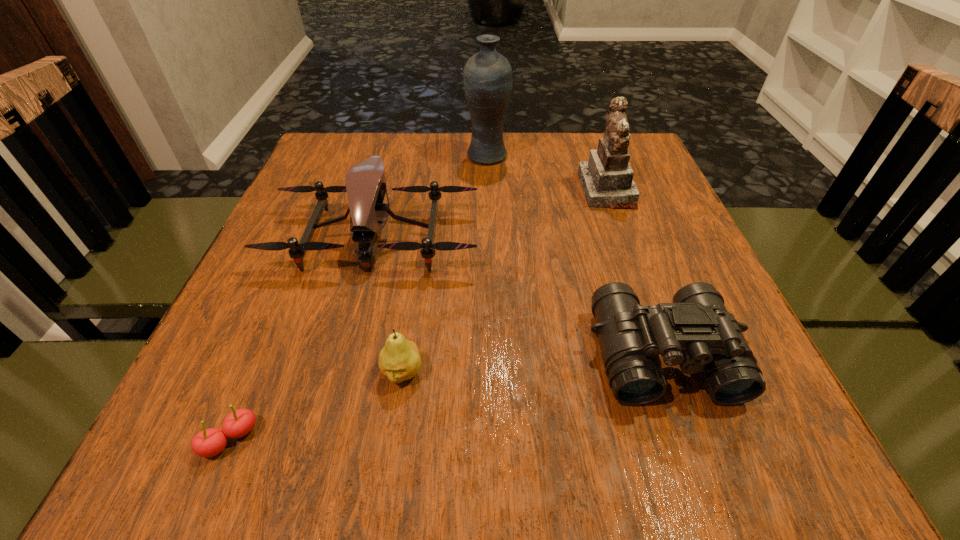
Where is `vacant space at the near right corner`? vacant space at the near right corner is located at coordinates (749, 423).

Where is `free spot between the second tallest object and the third shortest object`? free spot between the second tallest object and the third shortest object is located at coordinates (635, 272).

This screenshot has width=960, height=540. Find the location of `vacant region between the fourth tallest object and the pear`. vacant region between the fourth tallest object and the pear is located at coordinates (532, 364).

The height and width of the screenshot is (540, 960). I want to click on free spot between the pear and the second tallest object, so click(x=504, y=281).

Where is `free space between the vase and the third shortest object`? free space between the vase and the third shortest object is located at coordinates (575, 255).

What are the coordinates of `free area in between the vase and the binoculars` in the screenshot? It's located at (575, 255).

You are a GUI agent. You are given a task and a screenshot of the screen. Output one action in this format:
    pyautogui.click(x=<x>, y=<y>)
    Task: Click on the free space that is in between the tallest object and the second shortest object
    
    Given the screenshot: What is the action you would take?
    pyautogui.click(x=444, y=264)

This screenshot has height=540, width=960. In order to click on free area in between the vase and the fourth tallest object in this screenshot , I will do `click(575, 255)`.

At what (x,y) coordinates should I click in order to perform the action: click on free spot between the fifth tallest object and the farthest object. Please return your answer as a coordinate pair (x, y). The width and height of the screenshot is (960, 540). Looking at the image, I should click on (444, 264).

Locate an element on the screen. Image resolution: width=960 pixels, height=540 pixels. free space that is in between the tallest object and the second shortest object is located at coordinates (444, 264).